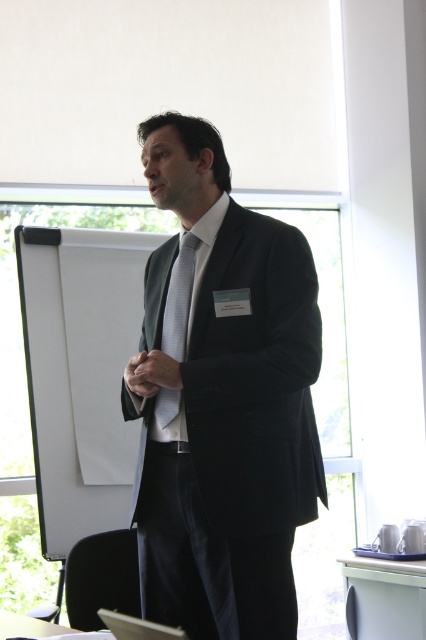
Question: Which point appears closest to the camera in this image?

Choices:
 (A) pos(212,536)
 (B) pos(172,356)

Answer: (A)

Question: Which point appears farthest from the camera in this image?

Choices:
 (A) (161, 253)
 (B) (175, 300)

Answer: (A)

Question: Is matte black suit at center further to camera compared to silky gray tie at center?

Choices:
 (A) no
 (B) yes

Answer: (A)

Question: Can you confirm if matte black suit at center is bigger than silky gray tie at center?

Choices:
 (A) yes
 (B) no

Answer: (A)

Question: Is matte black suit at center to the left of silky gray tie at center from the viewer's perspective?

Choices:
 (A) yes
 (B) no

Answer: (B)